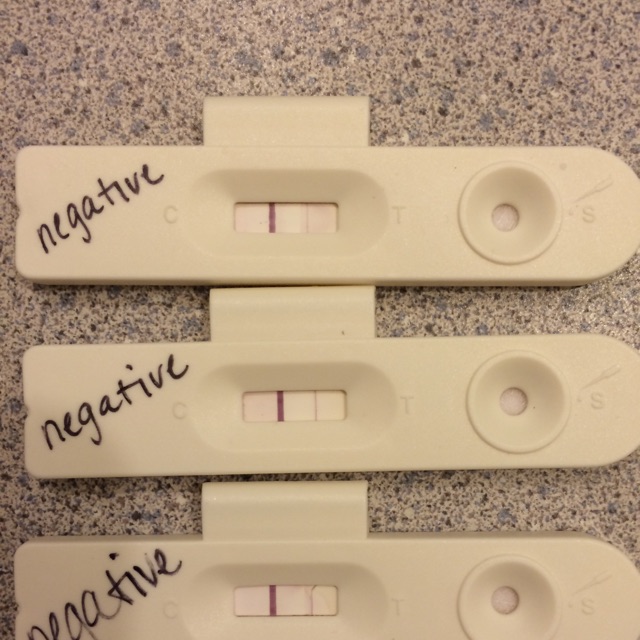
The height and width of the screenshot is (640, 640). I want to click on marble countertop, so click(431, 75).